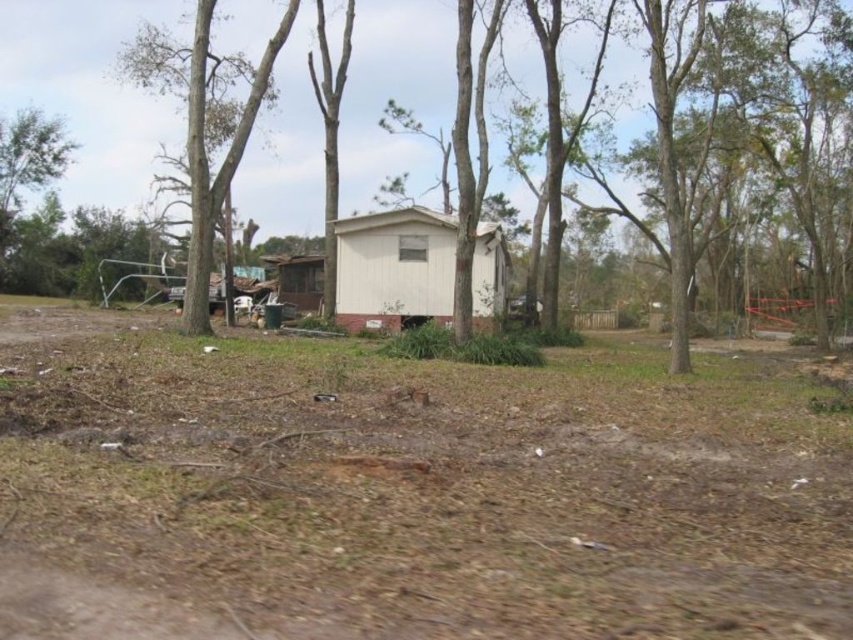
Does brown rough tree at left have a smaller size compared to brown corrugated metal hut at center?

No, brown rough tree at left is not smaller than brown corrugated metal hut at center.

Between point (200, 284) and point (277, 278), which one is positioned in front?

Point (200, 284) is more forward.

Identify the location of brown rough tree at left. (216, 145).

How much distance is there between white matte cabin at center and bare wood tree at center?

white matte cabin at center is 5.93 meters from bare wood tree at center.

Is point (374, 300) positioned before point (323, 256)?

Yes.

The width and height of the screenshot is (853, 640). Identify the location of white matte cabin at center. (393, 268).

Is brown dirt track at center to the right of white matte cabin at center from the viewer's perspective?

No, brown dirt track at center is not to the right of white matte cabin at center.

Can you confirm if brown dirt track at center is shorter than white matte cabin at center?

Yes.

Is point (634, 600) more distant than point (440, 291)?

No.

Find the location of a particular element. brown dirt track at center is located at coordinates (408, 490).